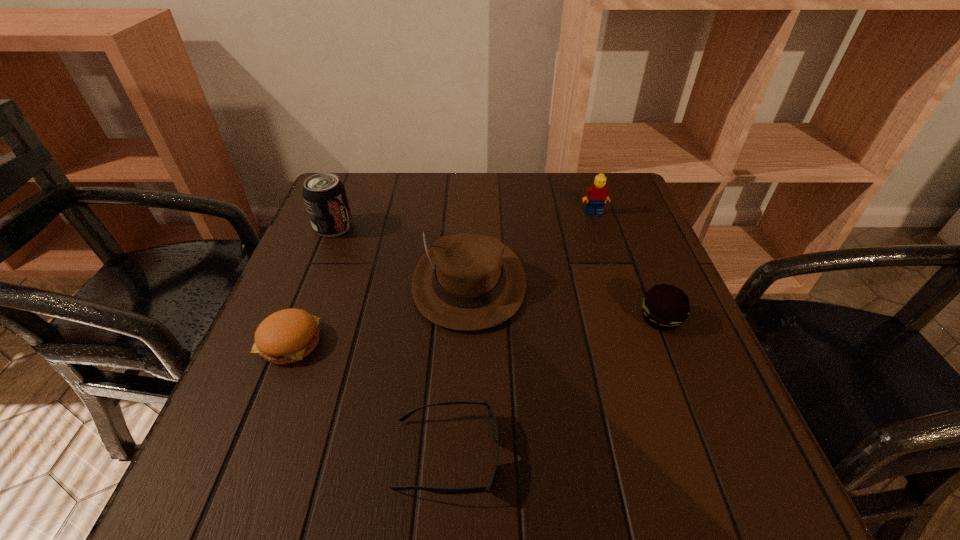
The height and width of the screenshot is (540, 960). What are the coordinates of `blank area at the far right corner` in the screenshot? It's located at (641, 222).

Locate an element on the screen. The image size is (960, 540). free space at the near right corner is located at coordinates (686, 488).

You are a GUI agent. You are given a task and a screenshot of the screen. Output one action in this format:
    pyautogui.click(x=<x>, y=<y>)
    Task: Click on the vacant region between the third shortest object and the shortest object
    The height and width of the screenshot is (540, 960).
    Given the screenshot: What is the action you would take?
    pyautogui.click(x=554, y=387)

The width and height of the screenshot is (960, 540). Identify the location of vacant space that's between the soda can and the shortest object. (391, 341).

At what (x,y) coordinates should I click in order to perform the action: click on vacant space that's between the fifth nearest object and the third tallest object. Please return your answer as a coordinate pair (x, y). The height and width of the screenshot is (540, 960). Looking at the image, I should click on [x=464, y=220].

The image size is (960, 540). What are the coordinates of `vacant area that lies between the second farthest object and the nearest object` in the screenshot? It's located at (391, 341).

Where is `vacant region between the nearest object and the fedora`? vacant region between the nearest object and the fedora is located at coordinates (458, 368).

The image size is (960, 540). Find the location of `empty space that is in between the nearest object and the Lego`. empty space that is in between the nearest object and the Lego is located at coordinates (520, 334).

Locate an element on the screen. Image resolution: width=960 pixels, height=540 pixels. empty space that is in between the sunglasses and the fifth nearest object is located at coordinates (391, 341).

Locate an element on the screen. Image resolution: width=960 pixels, height=540 pixels. vacant space in between the fedora and the sunglasses is located at coordinates (458, 368).